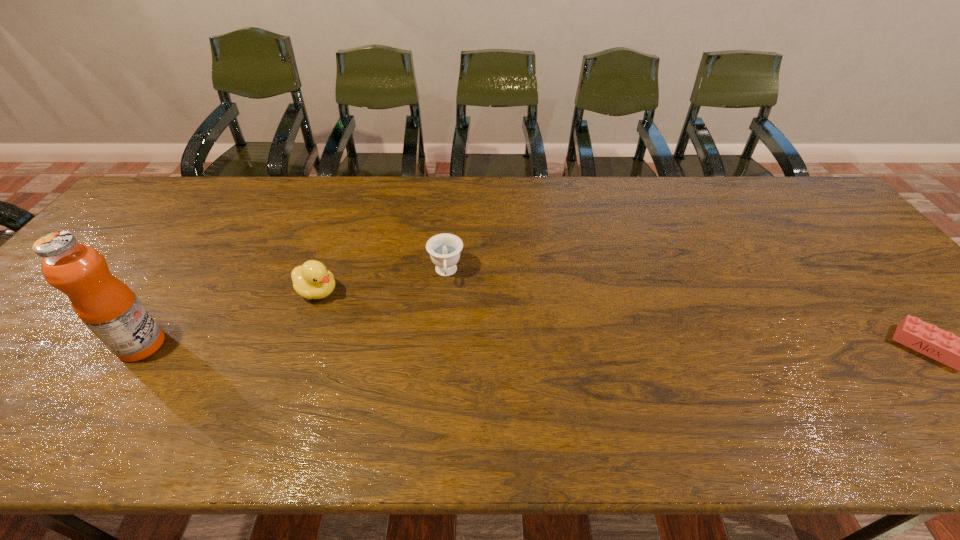
Identify the location of free space between the teacup and the third shortest object. (381, 282).

Find the location of `unoccupied position between the third object from right to left and the tallest object`. unoccupied position between the third object from right to left and the tallest object is located at coordinates (229, 318).

The height and width of the screenshot is (540, 960). I want to click on free space between the second tallest object and the tallest object, so click(229, 318).

The height and width of the screenshot is (540, 960). Identify the location of free space between the second object from left to right and the tallest object. (229, 318).

At what (x,y) coordinates should I click in order to perform the action: click on object that is the second closest to the leftmost object. Please return your answer as a coordinate pair (x, y). Looking at the image, I should click on (444, 249).

Point out which object is positioned as the third nearest to the third tallest object. Please provide its 2D coordinates. Your answer should be formatted as a tuple, i.e. [(x, y)], where the tuple contains the x and y coordinates of a point satisfying the conditions above.

[(959, 353)]